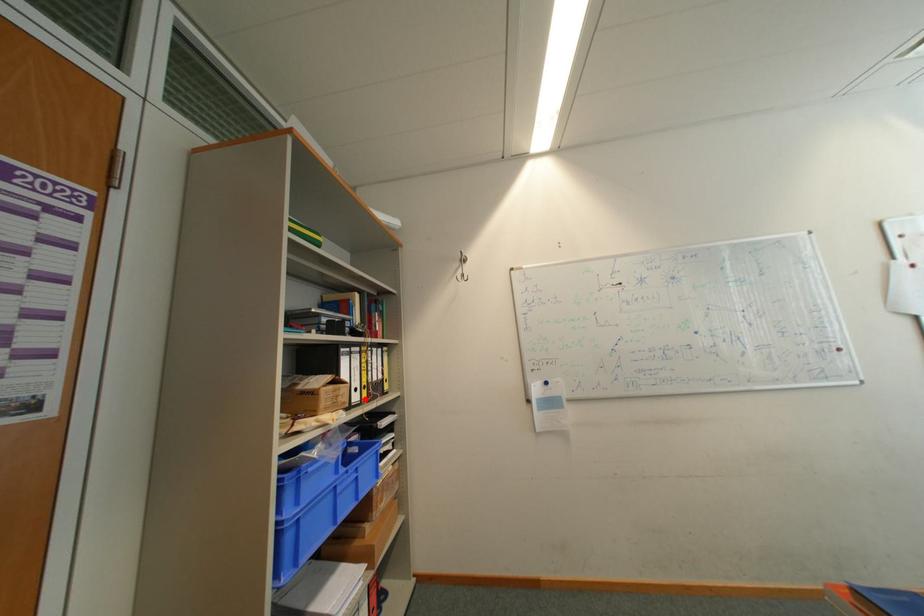
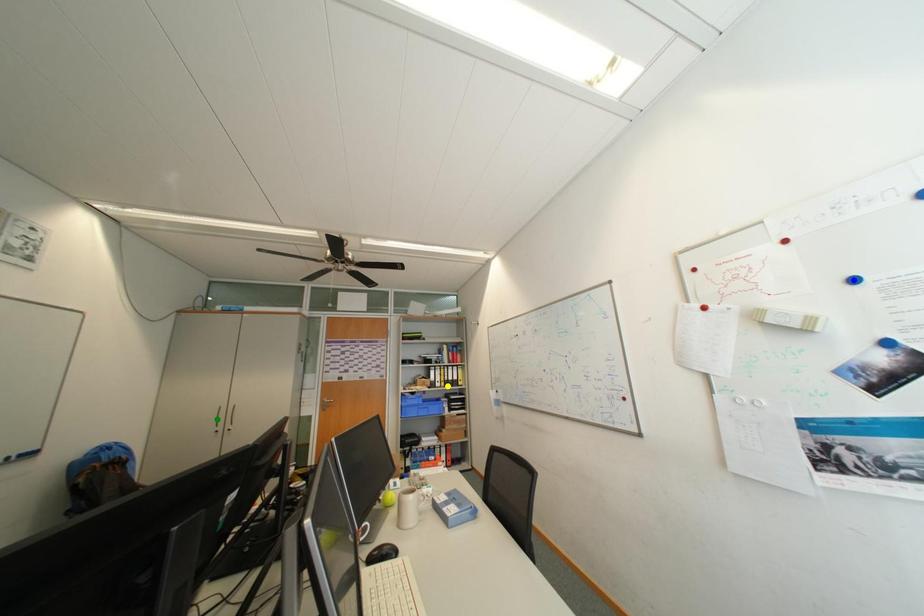
Question: I am providing you with two images of the same scene from different viewpoints. A red point is marked on the first image. You are given multiple points on the second image. Which point in image 2 is actually the same real-world point as the red point in image 1?

Choices:
 (A) green point
 (B) blue point
 (C) yellow point

Answer: (C)